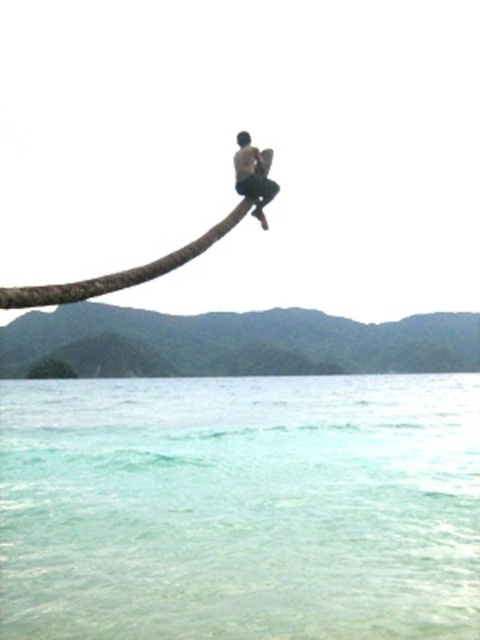
Question: Observing the image, what is the correct spatial positioning of brown rough tree branch at upper center in reference to dark skin human at center?

Choices:
 (A) right
 (B) left

Answer: (B)

Question: Considering the relative positions of green matte tree trunk at lower center and dark skin human at center in the image provided, where is green matte tree trunk at lower center located with respect to dark skin human at center?

Choices:
 (A) right
 (B) left

Answer: (A)

Question: Among these objects, which one is nearest to the camera?

Choices:
 (A) green matte tree trunk at lower center
 (B) brown rough tree branch at upper center

Answer: (B)

Question: Which point appears closest to the camera in this image?

Choices:
 (A) (269, 348)
 (B) (226, 592)
 (C) (259, 202)

Answer: (C)

Question: Which point is closer to the camera?

Choices:
 (A) (141, 355)
 (B) (261, 156)
 (C) (454, 604)
 (D) (120, 276)

Answer: (D)

Question: Is clear water at lower center positioned in front of dark skin human at center?

Choices:
 (A) no
 (B) yes

Answer: (A)